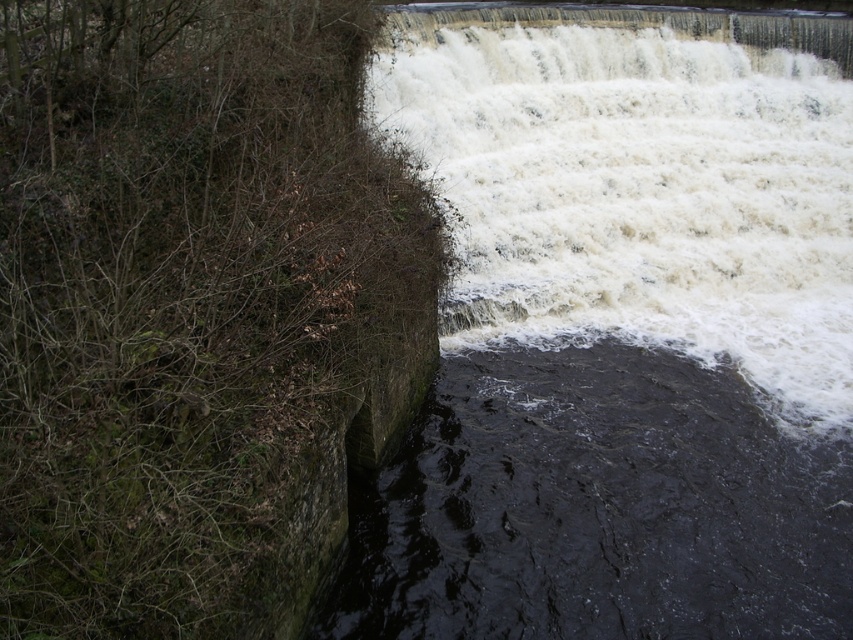
Question: Which point is farther to the camera?

Choices:
 (A) dark stone river at lower left
 (B) white frothy water at upper right

Answer: (B)

Question: From the image, what is the correct spatial relationship of white frothy water at upper right in relation to dark stone river at lower left?

Choices:
 (A) above
 (B) below

Answer: (A)

Question: Is white frothy water at upper right thinner than dark stone river at lower left?

Choices:
 (A) yes
 (B) no

Answer: (B)

Question: Where is white frothy water at upper right located in relation to dark stone river at lower left in the image?

Choices:
 (A) left
 (B) right

Answer: (B)